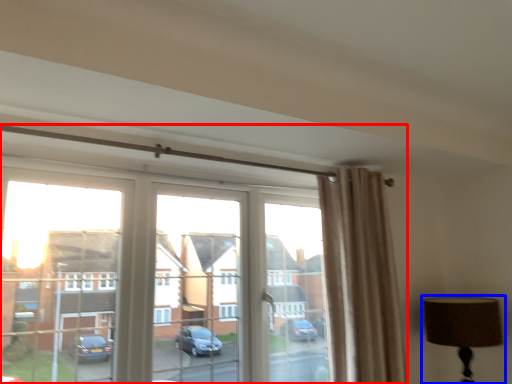
Question: Which object appears farthest to the camera in this image, window (highlighted by a red box) or table lamp (highlighted by a blue box)?

Choices:
 (A) window
 (B) table lamp

Answer: (B)